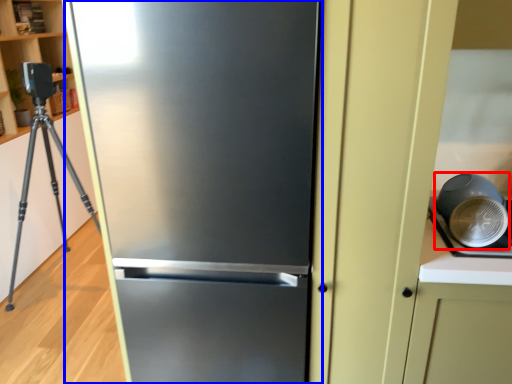
Question: Which of the following is the farthest to the observer, appliance (highlighted by a red box) or refrigerator (highlighted by a blue box)?

Choices:
 (A) appliance
 (B) refrigerator

Answer: (A)